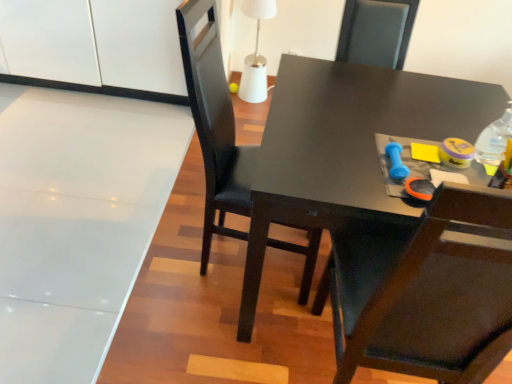
Find the location of a particular element. Image resolution: width=512 pixels, height=384 pixels. vacant space to the left of transparent plastic bottle at upper right is located at coordinates (425, 142).